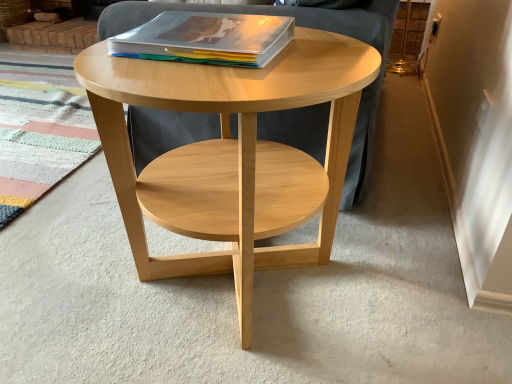
Identify the location of vacant region to the right of matte plastic magazine at center. This screenshot has width=512, height=384. (324, 56).